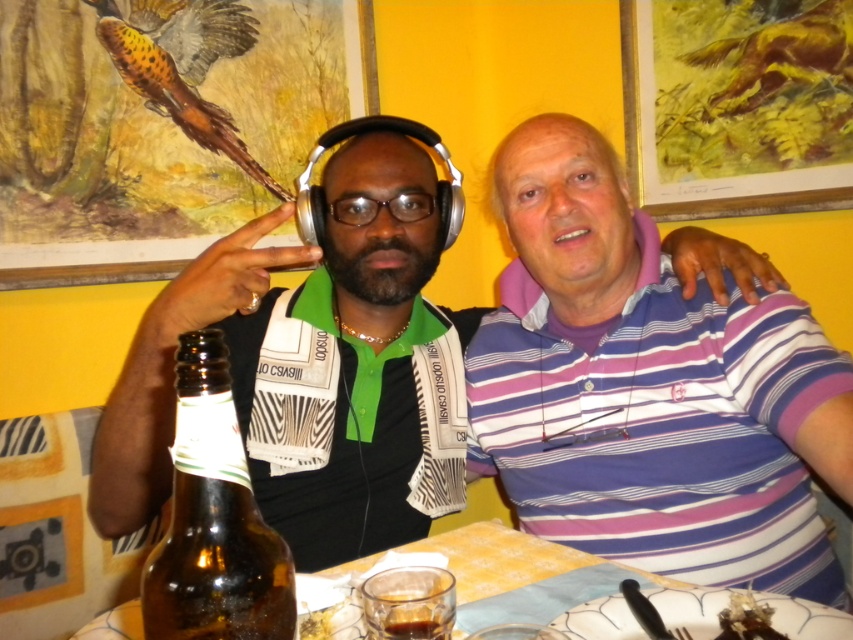
You are a photographer trying to capture a closeup shot of the shiny chocolate bar at lower right without including the purple striped polo shirt at right in the frame. Given their relative sizes, is this feasible?

The purple striped polo shirt at right is wider than the shiny chocolate bar at lower right. Since the polo shirt is wider, it might block the view of the chocolate bar unless positioned carefully. However, since the chocolate bar is at lower right and the polo shirt is at the right, adjusting the camera angle downward could exclude the polo shirt while focusing on the chocolate bar.

You are a photographer trying to capture a candid shot of the two people at the table. You notice the matte black headphones at left and the translucent glass table at lower center. Which object is closer to the photographer when standing directly in front of the table?

The matte black headphones at left are closer to the photographer because the translucent glass table at lower center is behind them, meaning the headphones are positioned nearer to the front of the table where the photographer is standing.

You are standing at the origin point of the image. Which object from the list is located at the coordinates point (648, 388)?

The purple striped polo shirt at right is located at point (648, 388).